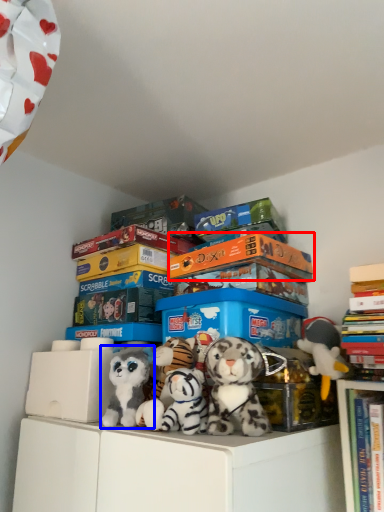
Question: Which of the following is the farthest to the observer, book (highlighted by a red box) or toy (highlighted by a blue box)?

Choices:
 (A) book
 (B) toy

Answer: (A)